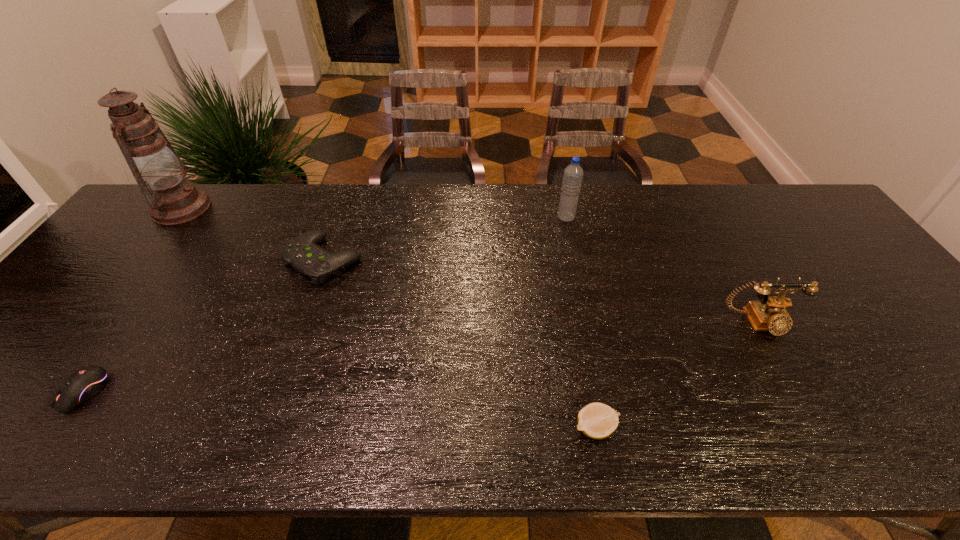
You are a GUI agent. You are given a task and a screenshot of the screen. Output one action in this format:
    pyautogui.click(x=<x>, y=<y>)
    Task: Click on the vacant space located on the dial number of the fourth shortest object
    The height and width of the screenshot is (540, 960).
    Given the screenshot: What is the action you would take?
    pyautogui.click(x=820, y=434)

You are a GUI agent. You are given a task and a screenshot of the screen. Output one action in this format:
    pyautogui.click(x=<x>, y=<y>)
    Task: Click on the vacant area situated on the left of the control
    The height and width of the screenshot is (540, 960).
    Given the screenshot: What is the action you would take?
    pyautogui.click(x=174, y=259)

The image size is (960, 540). I want to click on vacant space located on the right of the computer mouse, so click(202, 392).

Where is `vacant space situated on the left of the lemon`? The height and width of the screenshot is (540, 960). vacant space situated on the left of the lemon is located at coordinates (471, 428).

You are a GUI agent. You are given a task and a screenshot of the screen. Output one action in this format:
    pyautogui.click(x=<x>, y=<y>)
    Task: Click on the oil lamp present at the far edge
    The height and width of the screenshot is (540, 960).
    Given the screenshot: What is the action you would take?
    pyautogui.click(x=154, y=163)

The height and width of the screenshot is (540, 960). I want to click on water bottle that is at the far edge, so click(x=573, y=173).

Find the location of a particular element. This screenshot has height=540, width=960. computer mouse located at the near edge is located at coordinates (85, 383).

You are a GUI agent. You are given a task and a screenshot of the screen. Output one action in this format:
    pyautogui.click(x=<x>, y=<y>)
    Task: Click on the lemon situated at the near edge
    This screenshot has width=960, height=540.
    Given the screenshot: What is the action you would take?
    pyautogui.click(x=596, y=420)

Image resolution: width=960 pixels, height=540 pixels. I want to click on object positioned at the left edge, so click(154, 163).

Identify the location of object at the far left corner. (154, 163).